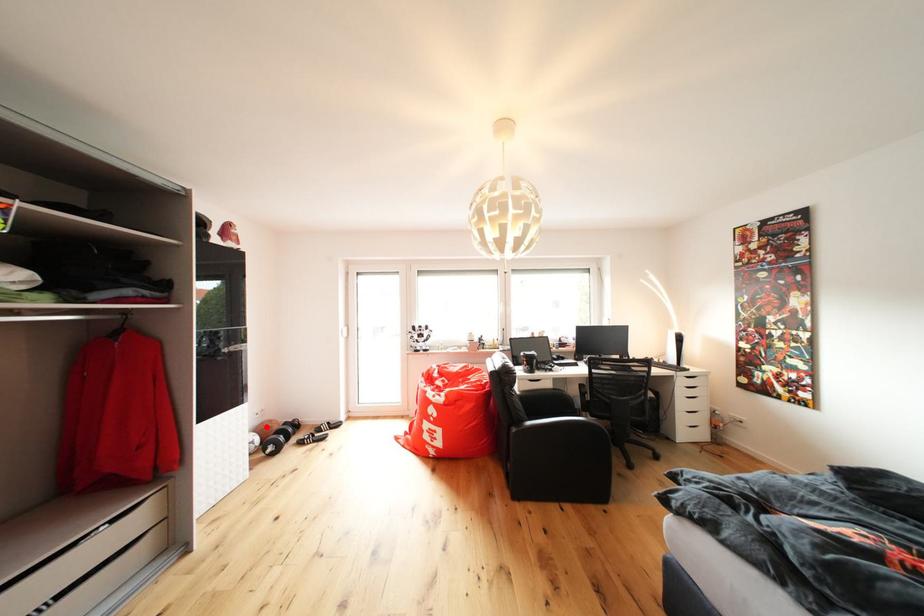
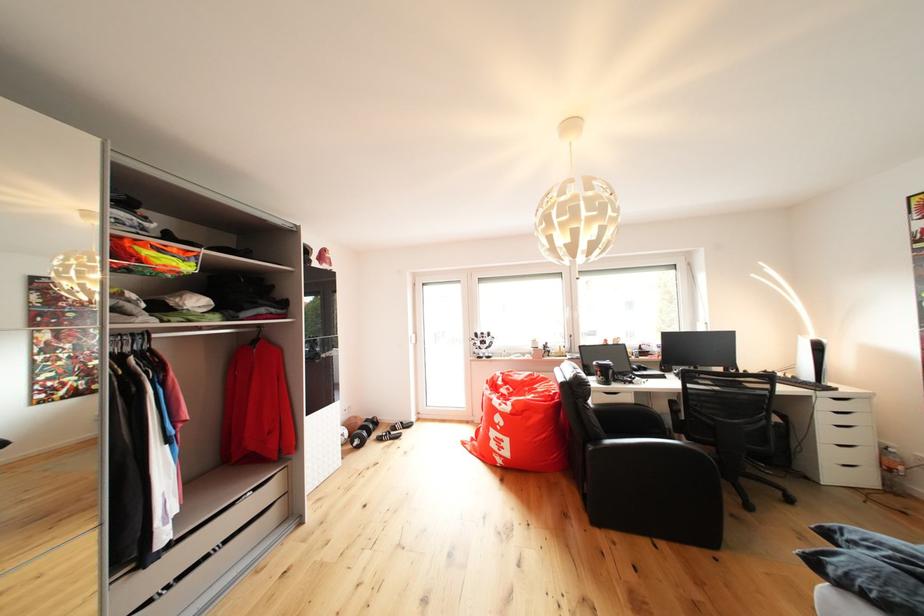
Question: I am providing you with two images of the same scene from different viewpoints. A red point is marked on the first image. Is the red point's position out of view in image 2?

Choices:
 (A) Yes
 (B) No

Answer: (B)